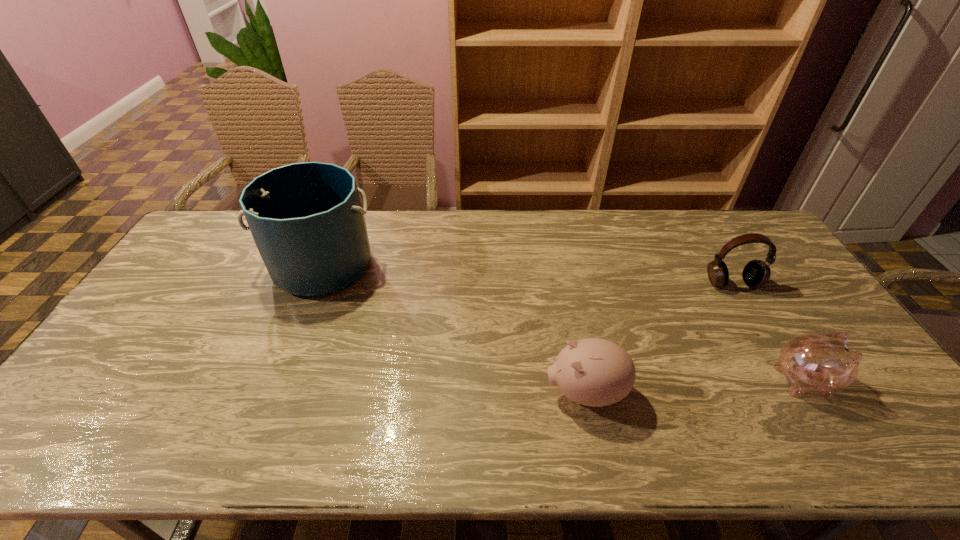
Where is `vacant space located on the front facing side of the right piggy bank`? Image resolution: width=960 pixels, height=540 pixels. vacant space located on the front facing side of the right piggy bank is located at coordinates (866, 380).

Identify the location of object that is at the far edge. coord(306,219).

Where is `headset positioned at the right edge`? This screenshot has height=540, width=960. headset positioned at the right edge is located at coordinates (756, 273).

This screenshot has width=960, height=540. I want to click on piggy bank located in the right edge section of the desktop, so click(x=821, y=363).

Where is `vacant space at the far edge of the desktop`? The width and height of the screenshot is (960, 540). vacant space at the far edge of the desktop is located at coordinates click(x=641, y=222).

The height and width of the screenshot is (540, 960). In the image, there is a desktop. In order to click on vacant space at the near edge in this screenshot , I will do `click(652, 461)`.

In the image, there is a desktop. Where is `vacant region at the far right corner`? This screenshot has width=960, height=540. vacant region at the far right corner is located at coordinates (747, 220).

Find the location of `vacant space that is in between the left piggy bank and the right piggy bank`. vacant space that is in between the left piggy bank and the right piggy bank is located at coordinates (695, 387).

The width and height of the screenshot is (960, 540). Find the location of `vacant space that's between the headset and the tallest object`. vacant space that's between the headset and the tallest object is located at coordinates (527, 274).

This screenshot has height=540, width=960. I want to click on free space between the right piggy bank and the third object from right to left, so click(695, 387).